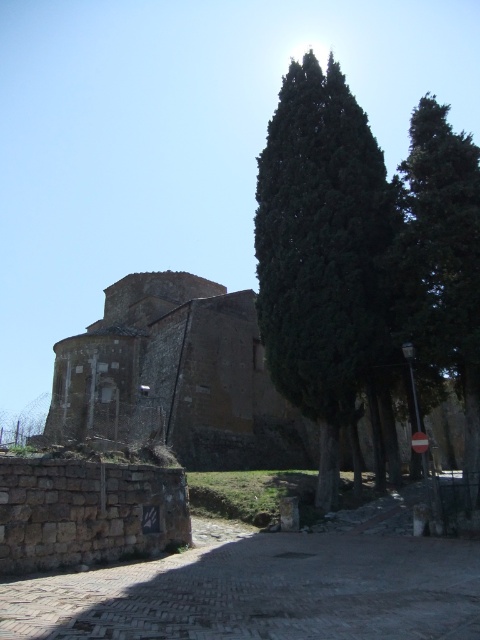
You are a gardener planning to water two green leafy trees. The first is the green leafy tree at center and the second is the green leafy tree at right. Your water hose can reach up to 7 meters. Starting from the center of the historic stone building, can you water both trees without moving the hose? Please explain your reasoning.

The distance between the green leafy tree at center and the green leafy tree at right is 7.44 meters. Since the hose can only reach up to 7 meters, the distance between them exceeds the hose length. Therefore, you cannot water both trees without moving the hose.

You are standing on the cobblestone pathway leading to the historic stone building and notice two points marked in the scene. The first point is at coordinates point (272, 168) and the second is at point (478, 208). Which of these two points is closer to your current position on the pathway?

Point (272, 168) is closer to your current position on the cobblestone pathway because it is further to the viewer compared to point (478, 208), which is located farther away.